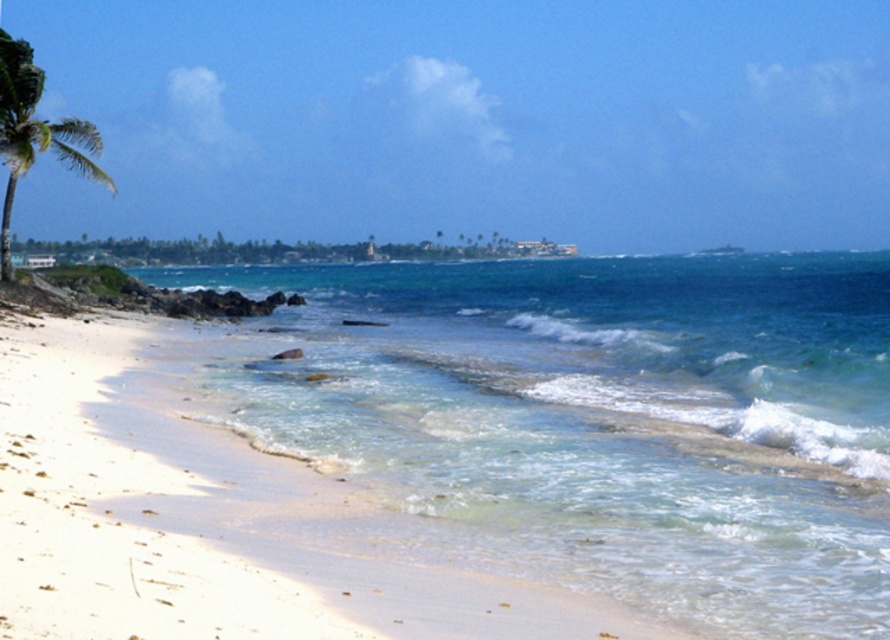
In the scene shown: Can you confirm if clear blue water at center is taller than green leafy palm tree at left?

In fact, clear blue water at center may be shorter than green leafy palm tree at left.

Does clear blue water at center have a larger size compared to green leafy palm tree at left?

No.

What do you see at coordinates (600, 417) in the screenshot? I see `clear blue water at center` at bounding box center [600, 417].

Find the location of a particular element. The width and height of the screenshot is (890, 640). clear blue water at center is located at coordinates (600, 417).